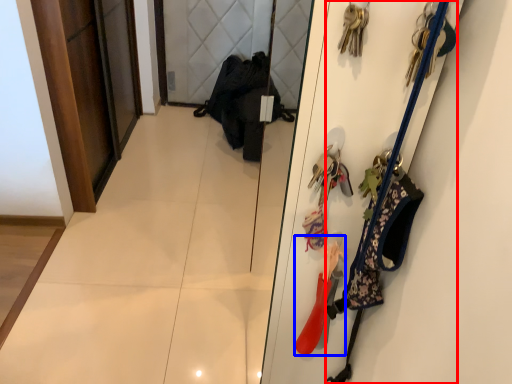
Question: Which point is further to the camera, accessory (highlighted by a red box) or accessory (highlighted by a blue box)?

Choices:
 (A) accessory
 (B) accessory

Answer: (B)